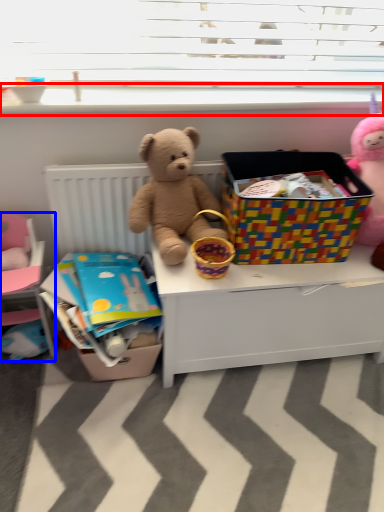
Question: Which object is further to the camera taking this photo, window sill (highlighted by a red box) or bed (highlighted by a blue box)?

Choices:
 (A) window sill
 (B) bed

Answer: (A)